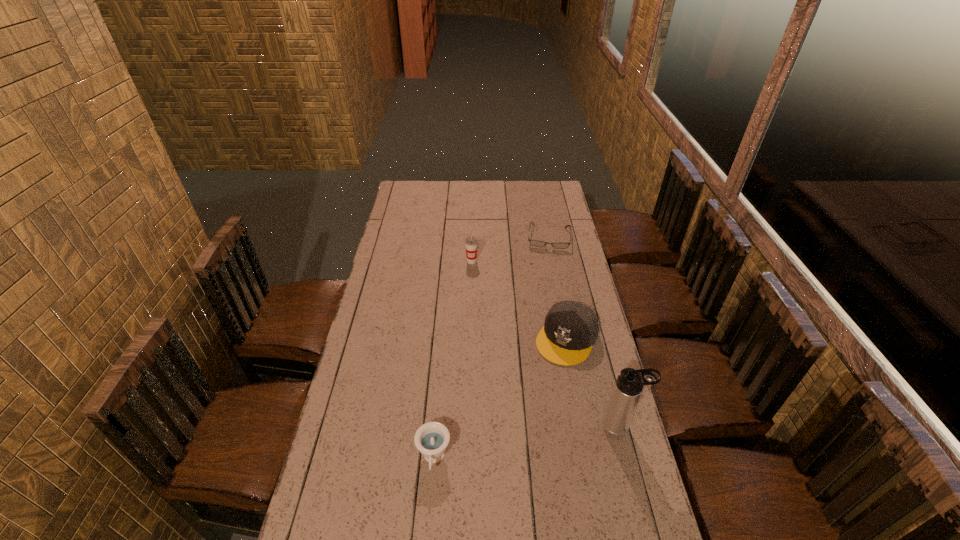
This screenshot has height=540, width=960. I want to click on free space that is in between the shortest object and the second tallest object, so click(510, 249).

Locate an element on the screen. vacant space that is in between the cap and the fourth tallest object is located at coordinates (500, 399).

I want to click on free spot between the fourth tallest object and the farthest object, so click(x=491, y=348).

Where is `object that is the closest one to the shortest object`? The image size is (960, 540). object that is the closest one to the shortest object is located at coordinates (471, 243).

Locate an element on the screen. This screenshot has height=540, width=960. object that is the closest to the cap is located at coordinates (629, 385).

Locate an element on the screen. This screenshot has width=960, height=540. vacant space that satisfies the following two spatial constraints: 1. on the front side of the cap; 2. on the handle side of the thermos bottle is located at coordinates (585, 427).